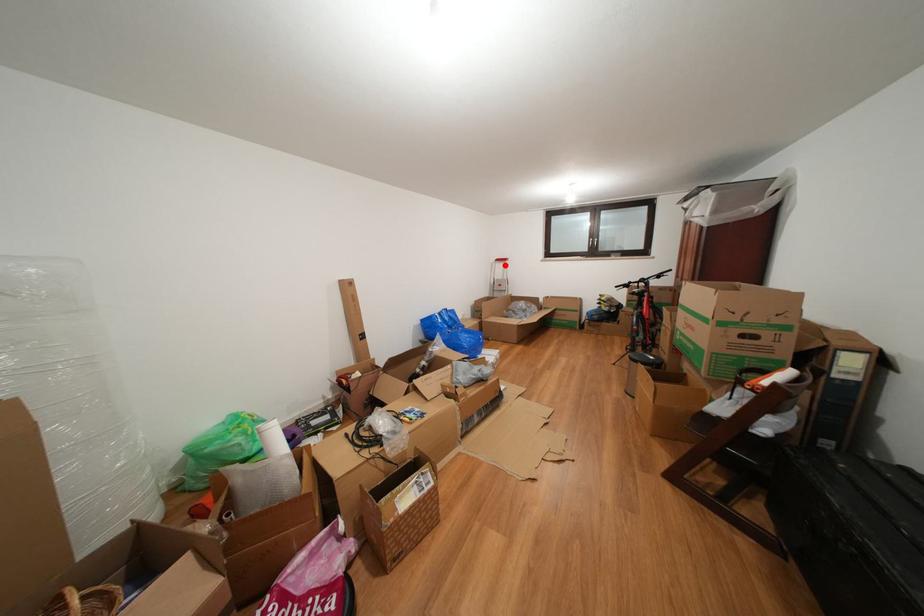
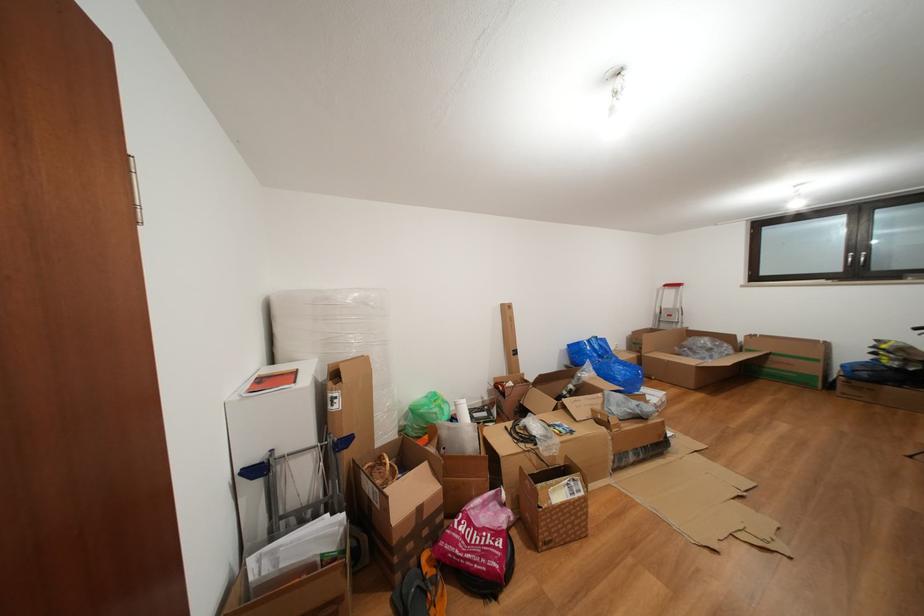
In the second image, find the point that corresponds to the highlighted location in the first image.

(674, 291)